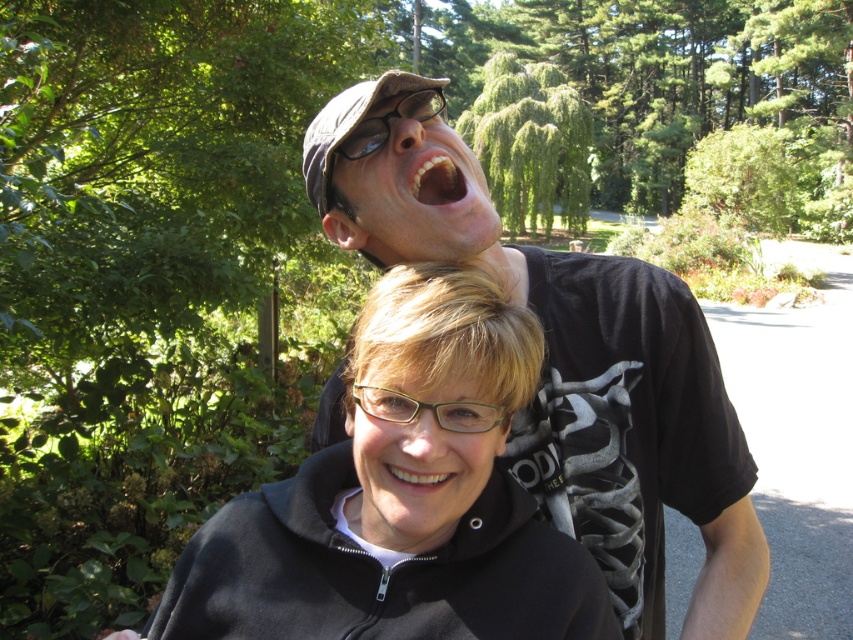
Is point (361, 388) more distant than point (426, 476)?

Yes.

Describe the element at coordinates (401, 497) in the screenshot. This screenshot has width=853, height=640. I see `black matte jacket at center` at that location.

Is point (363, 525) more distant than point (410, 465)?

Yes, point (363, 525) is behind point (410, 465).

The height and width of the screenshot is (640, 853). In order to click on black matte jacket at center in this screenshot , I will do `click(401, 497)`.

Can you confirm if black matte jacket at center is taller than white glossy teeth at upper center?

Correct, black matte jacket at center is much taller as white glossy teeth at upper center.

Who is more forward, (531, 566) or (426, 196)?

Positioned in front is point (531, 566).

You are a GUI agent. You are given a task and a screenshot of the screen. Output one action in this format:
    pyautogui.click(x=<x>, y=<y>)
    Task: Click on the black matte jacket at center
    
    Given the screenshot: What is the action you would take?
    pyautogui.click(x=401, y=497)

Does black matte t-shirt at upper center come behind white glossy teeth at upper center?

No, it is not.

Which of these two, black matte t-shirt at upper center or white glossy teeth at upper center, stands shorter?

white glossy teeth at upper center is shorter.

Which is behind, point (488, 237) or point (434, 150)?

The point (434, 150) is behind.

The width and height of the screenshot is (853, 640). Identify the location of black matte t-shirt at upper center. (572, 368).